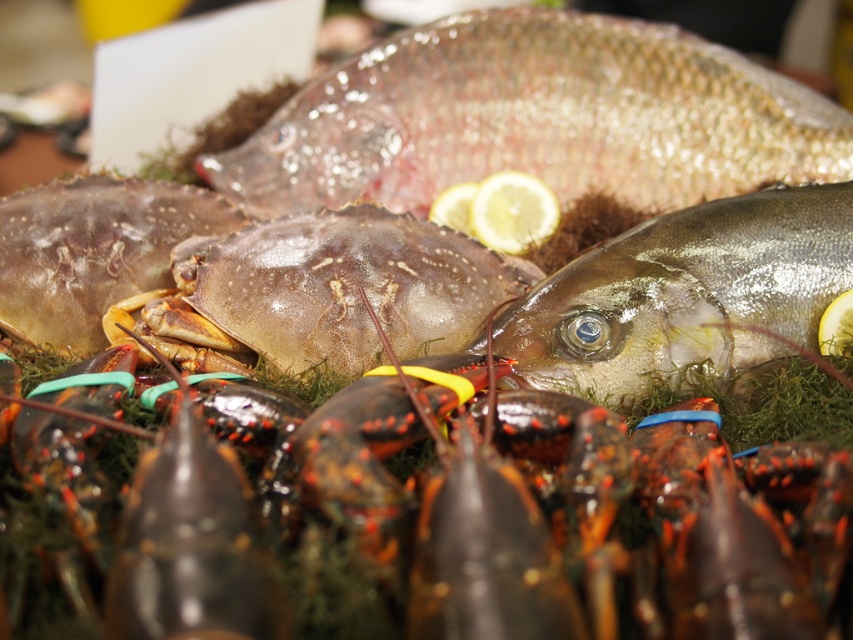
You are a customer at a seafood market and want to buy the shiny silver fish at center and the translucent brown crab at center. If you reach out to grab the one that is closer to you, which one would you pick?

The shiny silver fish at center is in front of the translucent brown crab at center, so you would pick the shiny silver fish at center since it is closer to you.

You are a customer at the seafood stall and want to point out two specific points on the display. The first point is at coordinates point (723, 282), and the second is at point (189, 248). Which point is closer to you when you are standing in front of the stall?

Point (723, 282) is in front of point (189, 248), so the first point is closer to you.

You are a photographer standing at the camera position. You want to take a closeup photo of the shiny silver fish at center. Can you reach it with your hand to adjust its position without moving your feet? Assume your arm can reach up to 90 centimeters.

The shiny silver fish at center and camera are 94.46 centimeters apart, which is beyond your arm reach of 90 centimeters. You cannot adjust its position without moving your feet.